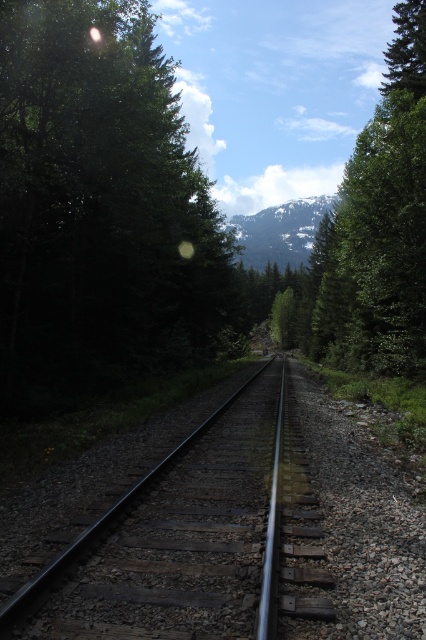
Question: Does green matte tree at left come behind smooth steel tracks at center?

Choices:
 (A) yes
 (B) no

Answer: (A)

Question: In this image, where is green matte tree at left located relative to green textured tree at upper right?

Choices:
 (A) below
 (B) above

Answer: (A)

Question: Which of these objects is positioned closest to the green matte tree at left?

Choices:
 (A) snowy rocky mountain at center
 (B) smooth steel tracks at center
 (C) green textured tree at upper right

Answer: (B)

Question: Which is farther from the smooth steel tracks at center?

Choices:
 (A) green matte tree at left
 (B) green textured tree at upper right
 (C) snowy rocky mountain at center

Answer: (C)

Question: Which object is closer to the camera taking this photo?

Choices:
 (A) snowy rocky mountain at center
 (B) green matte tree at left
 (C) green textured tree at upper right

Answer: (B)

Question: Is green matte tree at left below smooth steel tracks at center?

Choices:
 (A) no
 (B) yes

Answer: (A)